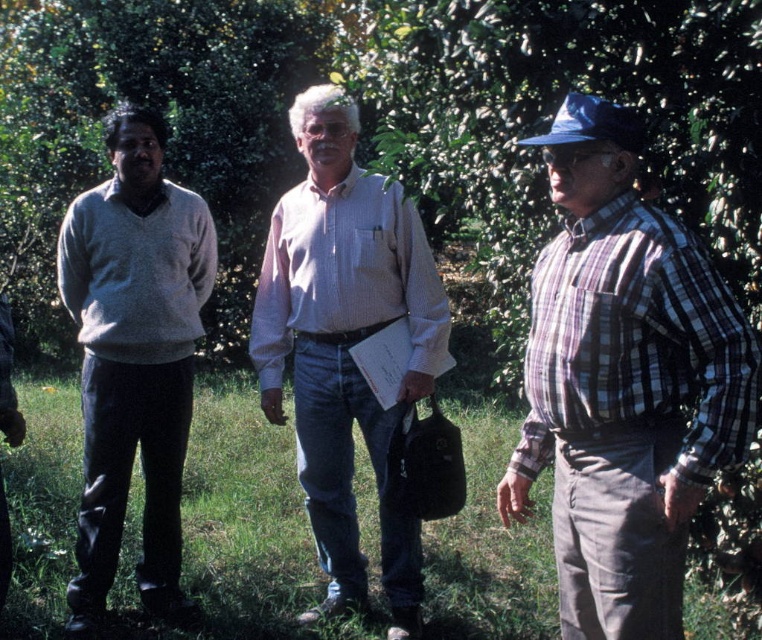
Question: Does plaid cotton shirt at right appear under pink striped shirt at center?

Choices:
 (A) no
 (B) yes

Answer: (B)

Question: Which is farther from the pink striped shirt at center?

Choices:
 (A) plaid cotton shirt at right
 (B) green leafy tree at center
 (C) matte gray sweater at left

Answer: (B)

Question: Which of these objects is positioned farthest from the matte gray sweater at left?

Choices:
 (A) pink striped shirt at center
 (B) green leafy tree at center
 (C) plaid cotton shirt at right

Answer: (B)

Question: Can you confirm if plaid cotton shirt at right is bigger than green leafy tree at center?

Choices:
 (A) no
 (B) yes

Answer: (A)

Question: Which of the following is the closest to the observer?

Choices:
 (A) plaid cotton shirt at right
 (B) matte gray sweater at left
 (C) green leafy tree at center

Answer: (A)

Question: Is pink striped shirt at center to the left of matte gray sweater at left from the viewer's perspective?

Choices:
 (A) no
 (B) yes

Answer: (A)